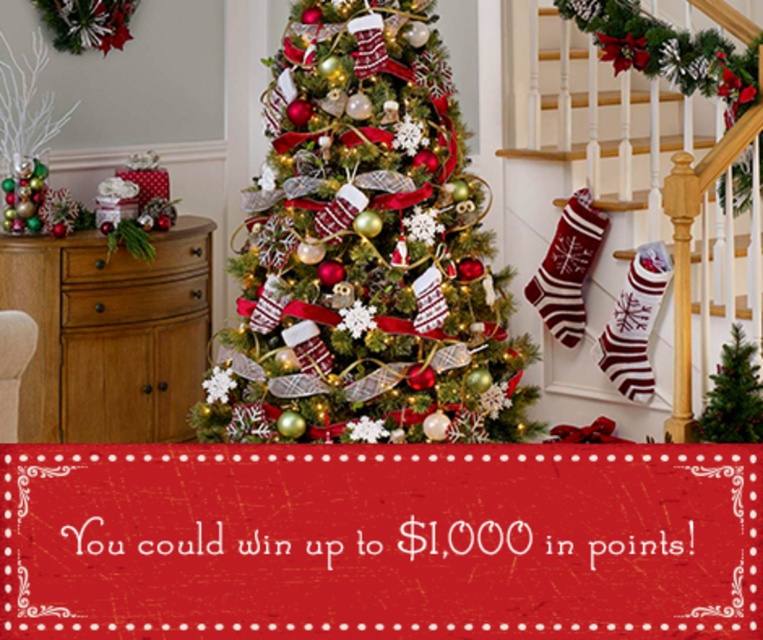
You are a delivery person trying to place a gift box that is 18 inches long between the knit stockings at center and the green matte christmas tree at center. Can the gift box fit in the space between them?

The distance between the knit stockings at center and the green matte christmas tree at center is 20.02 inches. Since the gift box is 18 inches long, it can fit in the space between them as the available space is slightly larger than the box.

You are a guest at a Christmas party and want to hang a new ornament on the tallest stocking among the knit stockings at center and the knit red and white striped stocking at right. Which stocking should you choose?

The knit stockings at center is taller than the knit red and white striped stocking at right, so you should choose the knit stockings at center to hang the ornament.

You are standing in front of the Christmas tree and want to place a gift under it. There are two stockings nearby. Which stocking is closer to the tree, the knit stockings at center or the striped wool stocking at right?

The knit stockings at center is closer to the tree because it is to the right of the striped wool stocking at right, meaning it is positioned between the tree and the striped wool stocking at right.